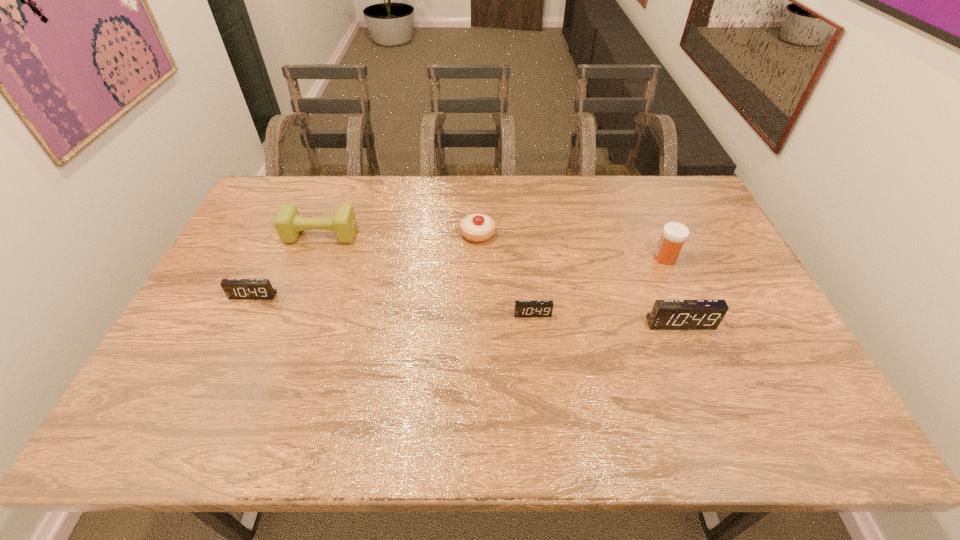
At what (x,y) coordinates should I click in order to perform the action: click on vacant space located 0.050m on the front-facing side of the rightmost alarm clock. Please return your answer as a coordinate pair (x, y). This screenshot has width=960, height=540. Looking at the image, I should click on (689, 346).

Identify the location of vacant space located 0.190m on the front of the pastry. The image size is (960, 540). (477, 291).

At what (x,y) coordinates should I click in order to perform the action: click on vacant space located 0.100m on the front of the dumbbell. Please return your answer as a coordinate pair (x, y). Looking at the image, I should click on (308, 267).

You are a GUI agent. You are given a task and a screenshot of the screen. Output one action in this format:
    pyautogui.click(x=<x>, y=<y>)
    Task: Click on the free space located on the front of the fourth nearest object
    The image size is (960, 540).
    Given the screenshot: What is the action you would take?
    pyautogui.click(x=676, y=283)

The width and height of the screenshot is (960, 540). Find the location of `alarm clock at the left edge`. alarm clock at the left edge is located at coordinates (236, 289).

At what (x,y) coordinates should I click in order to perform the action: click on dumbbell positioned at the left edge. Please return your answer as a coordinate pair (x, y). Looking at the image, I should click on (288, 223).

At what (x,y) coordinates should I click in order to perform the action: click on object situated at the right edge. Please return your answer as a coordinate pair (x, y). Looking at the image, I should click on (666, 314).

Identify the location of free spot at the far edge of the desktop. (455, 177).

I want to click on free space at the near edge, so click(x=490, y=390).

Find the location of `vacant space at the left edge of the desktop`. vacant space at the left edge of the desktop is located at coordinates (256, 302).